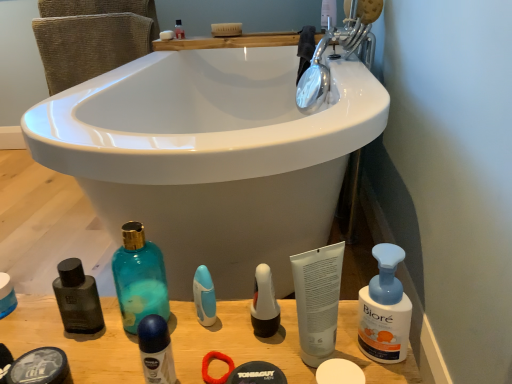
Locate an element on the screen. This screenshot has height=384, width=512. vacant area that lies to the right of blue matte deodorant at center, acting as the 2th toiletry starting from the bottom is located at coordinates (255, 347).